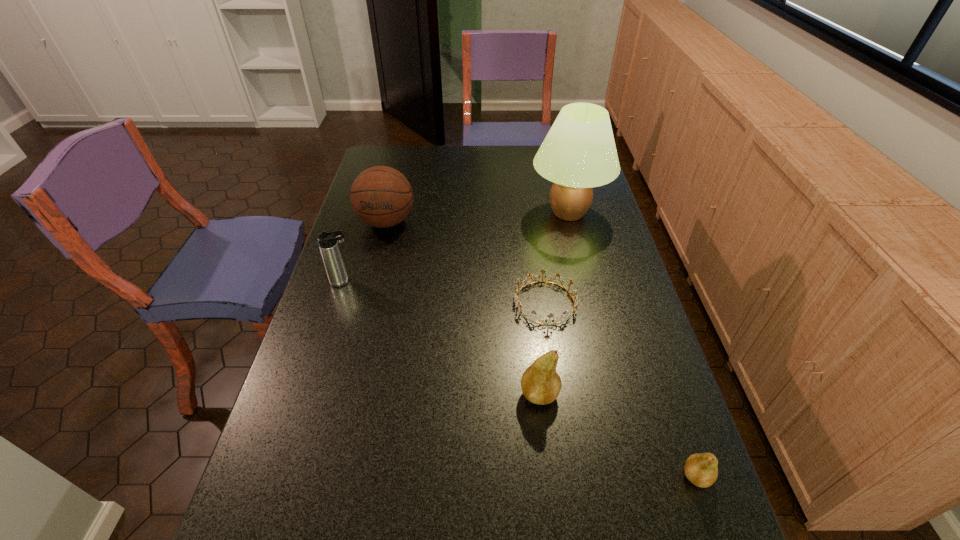
Observe the arrangement of all pears in the image. To keep them evenly spaced, where would you place another pear on the left? Please locate a free space. Please provide its 2D coordinates. Your answer should be formatted as a tuple, i.e. [(x, y)], where the tuple contains the x and y coordinates of a point satisfying the conditions above.

[(419, 332)]